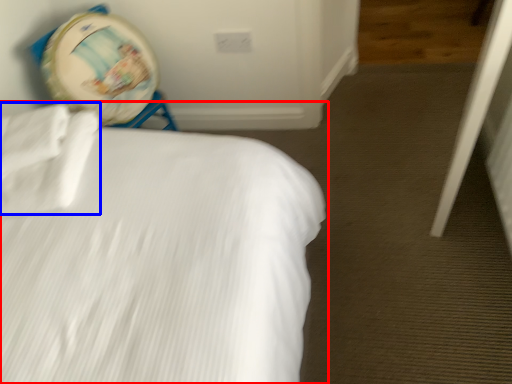
Question: Among these objects, which one is nearest to the camera, bed (highlighted by a red box) or sheet (highlighted by a blue box)?

Choices:
 (A) bed
 (B) sheet

Answer: (A)